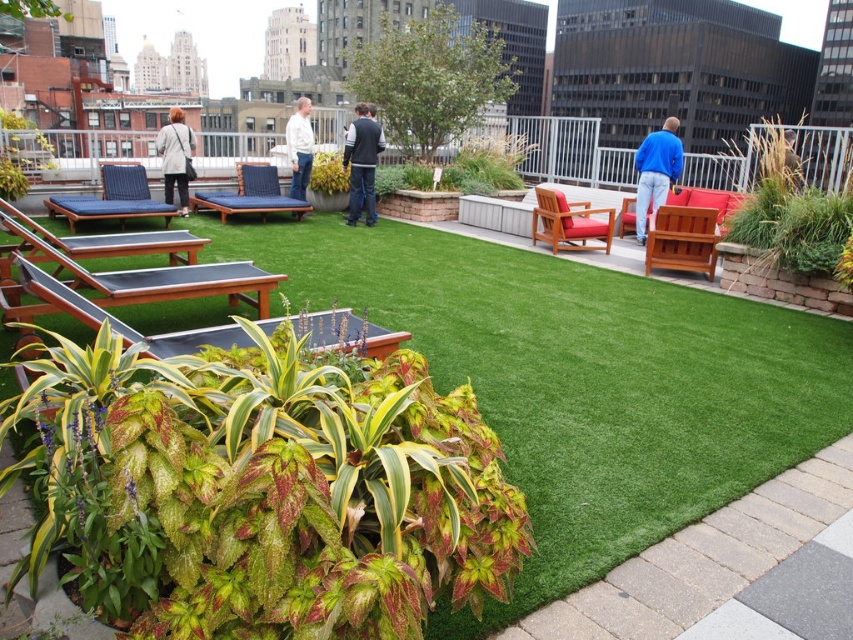
Question: Which object appears farthest from the camera in this image?

Choices:
 (A) green grass at center
 (B) variegated leafy plant at lower left
 (C) white cotton shirt at center

Answer: (C)

Question: Can you confirm if green grass at center is bigger than green leafy plant at center?

Choices:
 (A) yes
 (B) no

Answer: (A)

Question: Which object appears farthest from the camera in this image?

Choices:
 (A) green leafy plant at center
 (B) green artificial turf at center

Answer: (A)

Question: Which object is farther from the camera taking this photo?

Choices:
 (A) blue cotton shirt at center
 (B) green artificial turf at center
 (C) light gray fabric jacket at upper left
 (D) green grass at center

Answer: (C)

Question: Where is green grass at center located in relation to blue cotton shirt at center in the image?

Choices:
 (A) above
 (B) below

Answer: (B)

Question: Where is dark gray sweater at center located in relation to light gray fabric jacket at upper left in the image?

Choices:
 (A) right
 (B) left

Answer: (A)